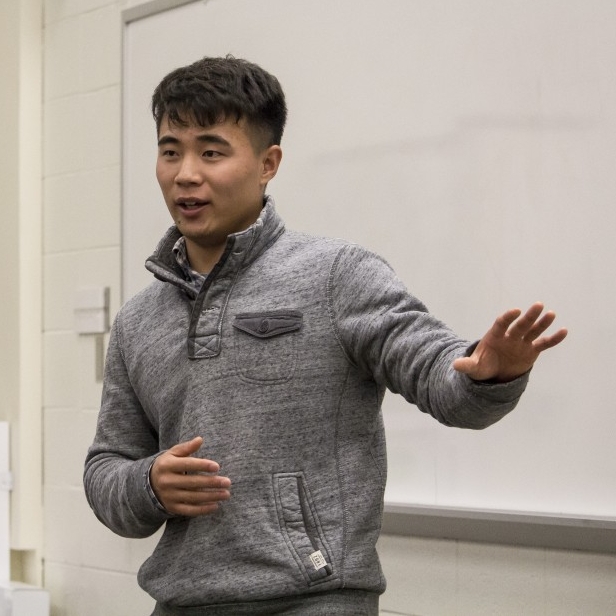
This screenshot has width=616, height=616. Find the location of `"smart" board`. "smart" board is located at coordinates (537, 251), (540, 521), (143, 47).